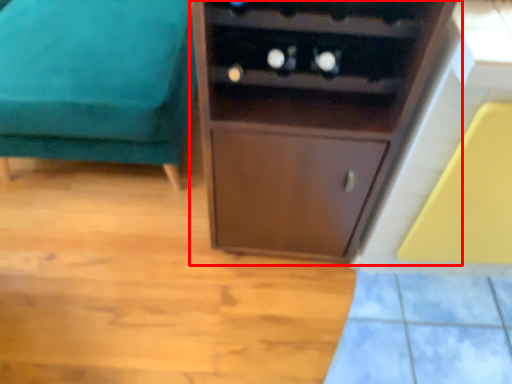
Question: Where is cupboard (annotated by the red box) located in relation to furniture in the image?

Choices:
 (A) left
 (B) right

Answer: (B)